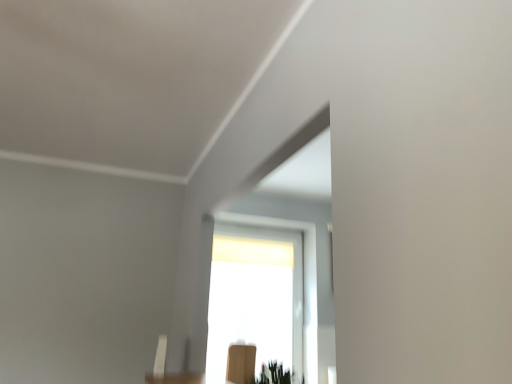
Question: Is transparent glass window at center closer to camera compared to green matte plant at lower center?

Choices:
 (A) yes
 (B) no

Answer: (B)

Question: Is transparent glass window at center directly adjacent to green matte plant at lower center?

Choices:
 (A) yes
 (B) no

Answer: (B)

Question: Is there a large distance between transparent glass window at center and green matte plant at lower center?

Choices:
 (A) yes
 (B) no

Answer: (A)

Question: Considering the relative positions of transparent glass window at center and green matte plant at lower center in the image provided, is transparent glass window at center to the left of green matte plant at lower center from the viewer's perspective?

Choices:
 (A) no
 (B) yes

Answer: (B)

Question: From the image's perspective, is transparent glass window at center on top of green matte plant at lower center?

Choices:
 (A) no
 (B) yes

Answer: (A)

Question: Considering their positions, is wooden chair at lower center located in front of or behind green matte plant at lower center?

Choices:
 (A) behind
 (B) front

Answer: (A)

Question: Considering the positions of wooden chair at lower center and green matte plant at lower center in the image, is wooden chair at lower center bigger or smaller than green matte plant at lower center?

Choices:
 (A) small
 (B) big

Answer: (B)

Question: Is wooden chair at lower center taller or shorter than green matte plant at lower center?

Choices:
 (A) tall
 (B) short

Answer: (A)

Question: Is point [236, 375] positioned closer to the camera than point [269, 379]?

Choices:
 (A) closer
 (B) farther

Answer: (B)

Question: Is transparent glass window at center wider or thinner than green matte plant at lower center?

Choices:
 (A) thin
 (B) wide

Answer: (A)

Question: From the image's perspective, is transparent glass window at center located above or below green matte plant at lower center?

Choices:
 (A) above
 (B) below

Answer: (B)

Question: Based on their positions, is transparent glass window at center located to the left or right of green matte plant at lower center?

Choices:
 (A) left
 (B) right

Answer: (A)

Question: Would you say transparent glass window at center is inside or outside green matte plant at lower center?

Choices:
 (A) inside
 (B) outside

Answer: (B)

Question: From the image's perspective, is green matte plant at lower center above or below transparent glass window at center?

Choices:
 (A) below
 (B) above

Answer: (B)

Question: Choose the correct answer: Is green matte plant at lower center inside transparent glass window at center or outside it?

Choices:
 (A) outside
 (B) inside

Answer: (A)